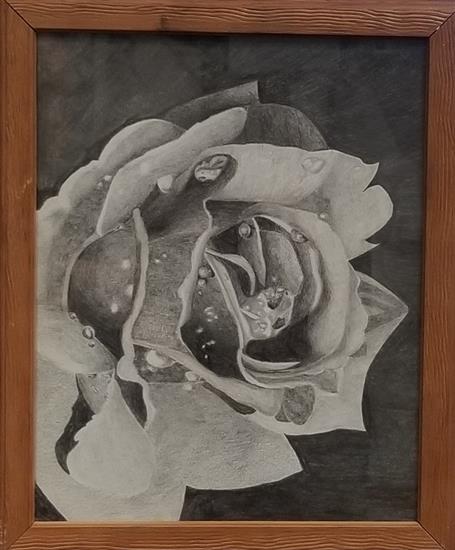
This screenshot has width=455, height=550. I want to click on top of picture frame, so click(212, 10).